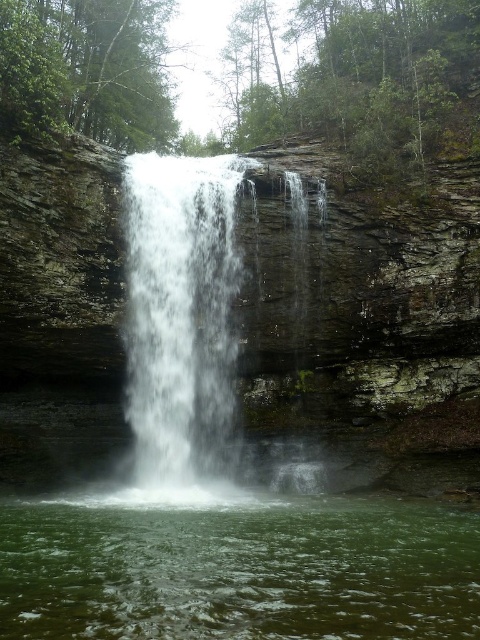
Which is above, green liquid at center or white frothy water at center?

Positioned higher is white frothy water at center.

Locate an element on the screen. Image resolution: width=480 pixels, height=640 pixels. green liquid at center is located at coordinates (238, 570).